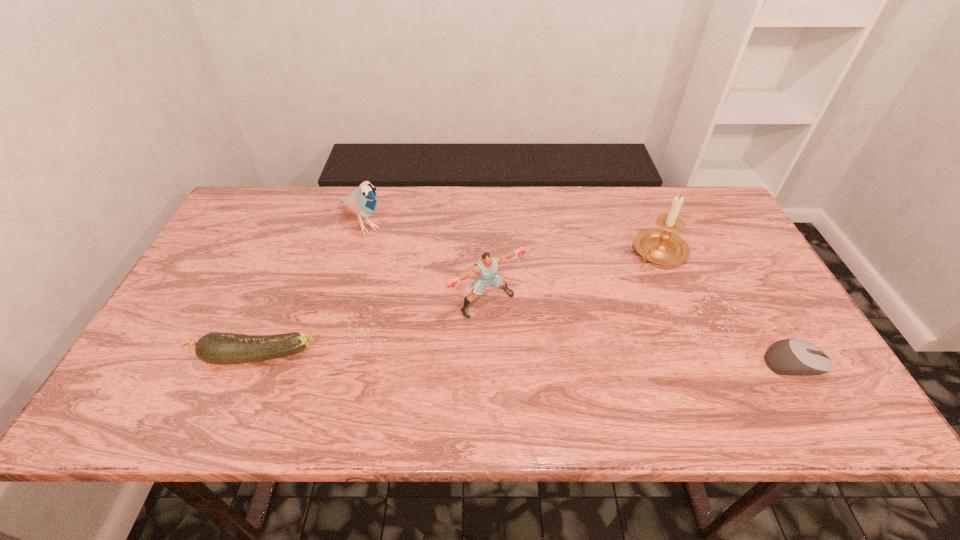
Locate an element on the screen. The image size is (960, 540). free space between the bird and the second object from right to left is located at coordinates (511, 237).

The width and height of the screenshot is (960, 540). Identify the location of vacant region between the second object from right to left and the second shortest object. (458, 304).

I want to click on free space between the fourth object from left to right and the computer equipment, so click(x=728, y=307).

In order to click on vacant space in between the shortest object and the zucchini in this screenshot , I will do `click(525, 360)`.

This screenshot has width=960, height=540. What are the coordinates of `free space between the rightmost object and the third object from left to right` in the screenshot? It's located at (640, 333).

Find the location of a particular element. The width and height of the screenshot is (960, 540). free spot between the zucchini and the second object from right to left is located at coordinates (458, 304).

Identify the location of free space between the puncher and the bird. The height and width of the screenshot is (540, 960). (424, 263).

I want to click on empty location between the puncher and the fourth tallest object, so coord(372,330).

This screenshot has width=960, height=540. What are the coordinates of `vacant space that is in between the candle holder and the puncher` in the screenshot? It's located at coord(573,277).

Point out which object is positioned as the second nearest to the fourth object from left to right. Please provide its 2D coordinates. Your answer should be formatted as a tuple, i.e. [(x, y)], where the tuple contains the x and y coordinates of a point satisfying the conditions above.

[(486, 267)]